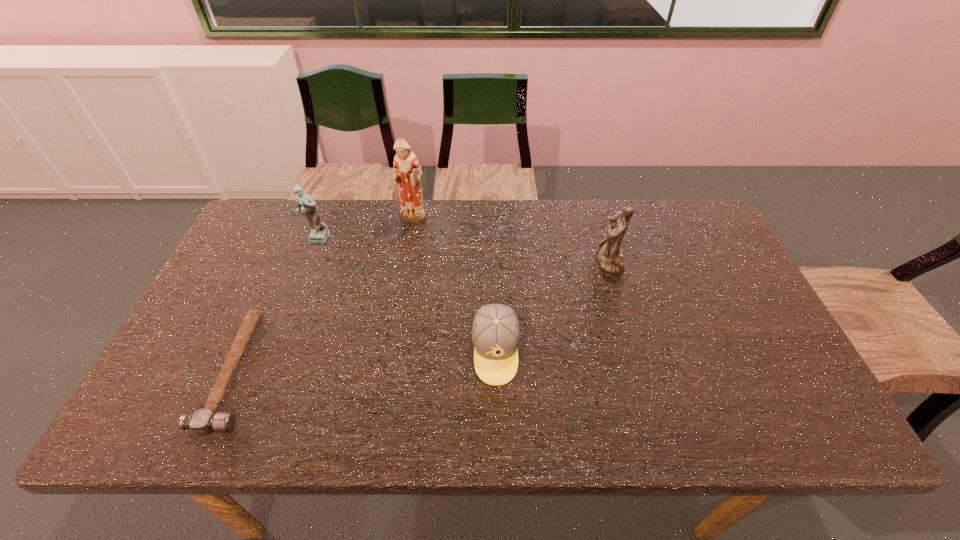
The height and width of the screenshot is (540, 960). Identify the location of vacant space located 0.060m on the front-facing side of the rightmost figurine. (576, 261).

Where is `vacant space located 0.340m on the front-facing side of the rightmost figurine`? This screenshot has height=540, width=960. vacant space located 0.340m on the front-facing side of the rightmost figurine is located at coordinates (481, 261).

Image resolution: width=960 pixels, height=540 pixels. I want to click on free space located 0.110m on the front-facing side of the baseball cap, so click(498, 432).

Identify the location of vacant space located 0.290m on the striking face of the hammer. This screenshot has width=960, height=540. (380, 370).

At what (x,y) coordinates should I click in order to perform the action: click on object that is at the near edge. Please return your answer as a coordinate pair (x, y). The height and width of the screenshot is (540, 960). Looking at the image, I should click on (203, 422).

Identify the location of object that is at the left edge. (203, 422).

Image resolution: width=960 pixels, height=540 pixels. I want to click on object that is at the near left corner, so click(203, 422).

Locate an element on the screen. free point at the far edge is located at coordinates (466, 231).

The width and height of the screenshot is (960, 540). I want to click on vacant space at the near edge of the desktop, so click(669, 426).

The width and height of the screenshot is (960, 540). Identify the location of vacant space at the left edge of the desktop. (219, 278).